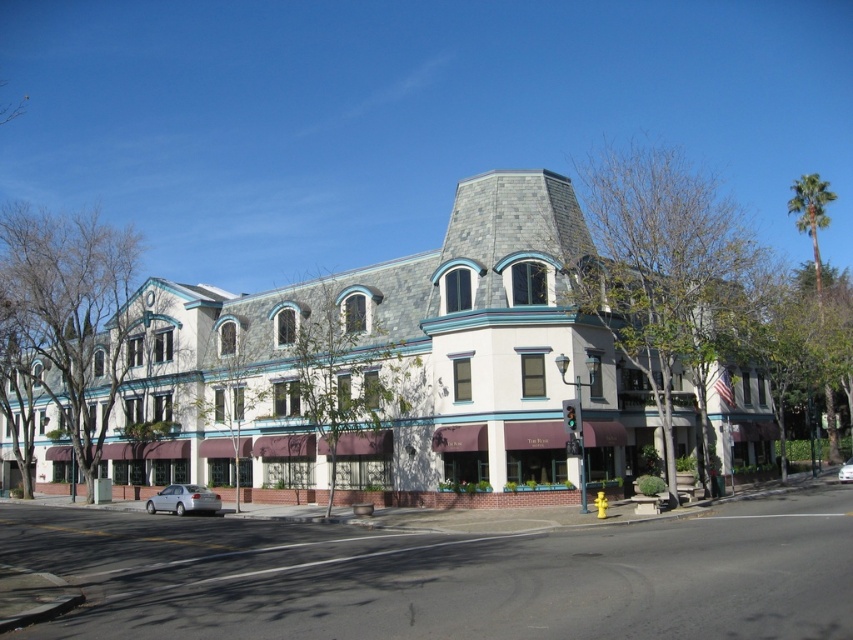
Does point (448, 333) come behind point (207, 509)?

No, it is not.

Consider the image. Who is more forward, (x=317, y=284) or (x=178, y=484)?

Point (x=178, y=484) is in front.

Image resolution: width=853 pixels, height=640 pixels. Identify the location of white stone building at center. pyautogui.click(x=392, y=365).

Can you confirm if white stone building at center is bigger than silver metallic car at center?

Yes.

Where is `white stone building at center`? This screenshot has width=853, height=640. white stone building at center is located at coordinates (392, 365).

Between silver metallic sedan at lower left and silver metallic car at center, which one is positioned higher?

silver metallic sedan at lower left

What do you see at coordinates (184, 499) in the screenshot? Image resolution: width=853 pixels, height=640 pixels. I see `silver metallic sedan at lower left` at bounding box center [184, 499].

Identify the location of silver metallic sedan at lower left. Image resolution: width=853 pixels, height=640 pixels. tap(184, 499).